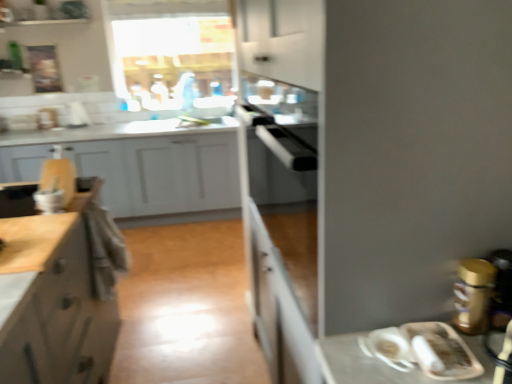
Question: Is point (5, 264) closer or farther from the camera than point (156, 158)?

Choices:
 (A) farther
 (B) closer

Answer: (B)

Question: From a real-world perspective, is matte white cabinet at left, placed as the 2th cabinetry when sorted from back to front, above or below white matte cabinet at left, arranged as the 3th cabinetry when viewed from the front?

Choices:
 (A) above
 (B) below

Answer: (A)

Question: Which object is positioned closest to the matte white cabinet at left, arranged as the second cabinetry when viewed from the front?

Choices:
 (A) white matte cabinet at left, arranged as the 3th cabinetry when viewed from the front
 (B) wooden cutting board at left, which is counted as the 1th cabinetry, starting from the front
 (C) gold metallic canister at right

Answer: (C)

Question: Based on their relative distances, which object is farther from the wooden cutting board at left, which is counted as the 3th cabinetry, starting from the back?

Choices:
 (A) matte white cabinet at left, arranged as the second cabinetry when viewed from the front
 (B) gold metallic canister at right
 (C) white matte cabinet at left, arranged as the 3th cabinetry when viewed from the front

Answer: (B)